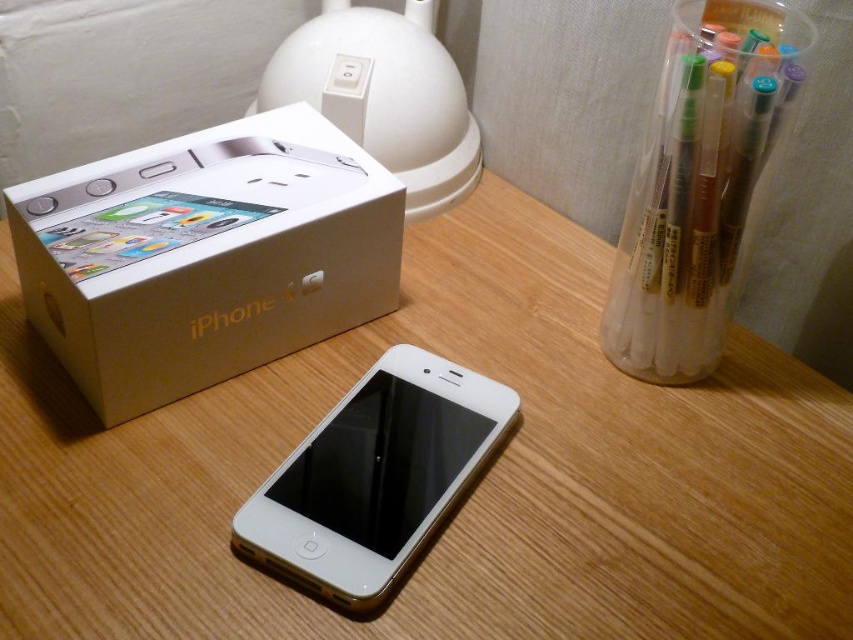
You are organizing items on a desk and have a white cardboard iPhone box at upper left and a white glossy iPod at center. Which item is wider?

The white cardboard iPhone box at upper left is wider than the white glossy iPod at center according to the description.

You are organizing items on a desk and need to place the white cardboard iphone box at upper left and the clear plastic pen at upper right. If you want to arrange them side by side horizontally, which item should be placed first to ensure they fit within the desk space?

The white cardboard iphone box at upper left should be placed first because it is wider than the clear plastic pen at upper right, so positioning it first ensures there is enough space for both items side by side.